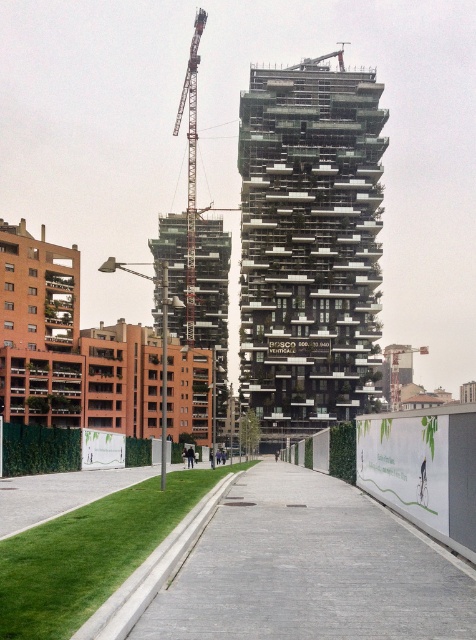
You are a construction worker standing at the point marked by the coordinates point (310, 570). You need to reach the nearest building under construction. Which building should you head towards?

The point (310, 570) marks gray concrete pavement at center. Since the building on the right is taller and more advanced in construction, it is closer to the central area, so the nearest building would be the one on the right.

You are a construction worker standing on the gray concrete pavement at center. You need to lift a heavy beam to the top floor of the building on the right. Can you use the metallic gray crane at upper center to do this?

The gray concrete pavement at center is located below the metallic gray crane at upper center, so yes, the metallic gray crane at upper center can be used to lift the beam from the gray concrete pavement at center to the top floor of the building on the right.

You are standing at the point marked as point (310, 570) in the center of the image. Looking towards the two high rise buildings, which building is closer to you?

The gray concrete pavement at center is where you are standing, and the point (310, 570) is located there. Since the building on the right is taller and more advanced in construction, it is closer to you than the one on the left which is partially obscured. Therefore, the building on the right is closer to you.